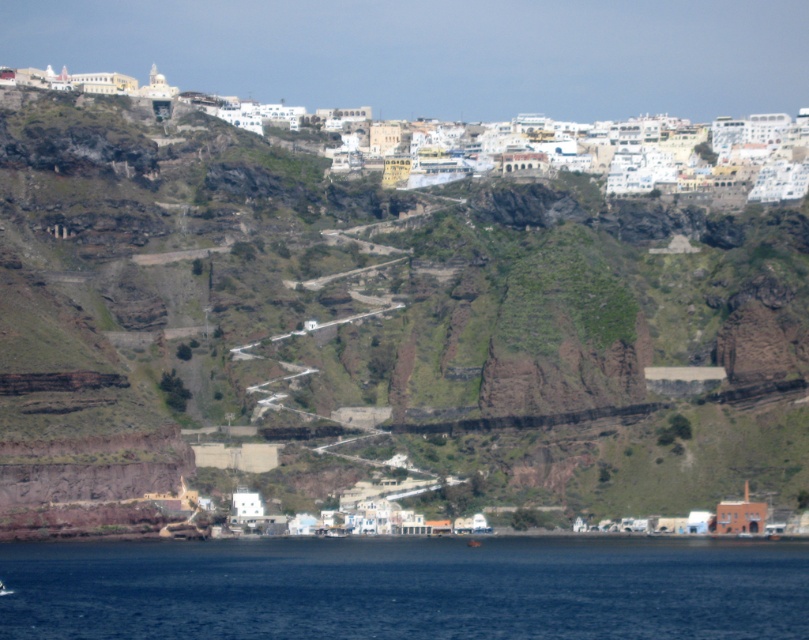
You are a geologist examining the cliff structure. You notice a brown rock at center. Can you determine its exact coordinates on the cliff face?

The brown rock at center is located at coordinates point (379,324).